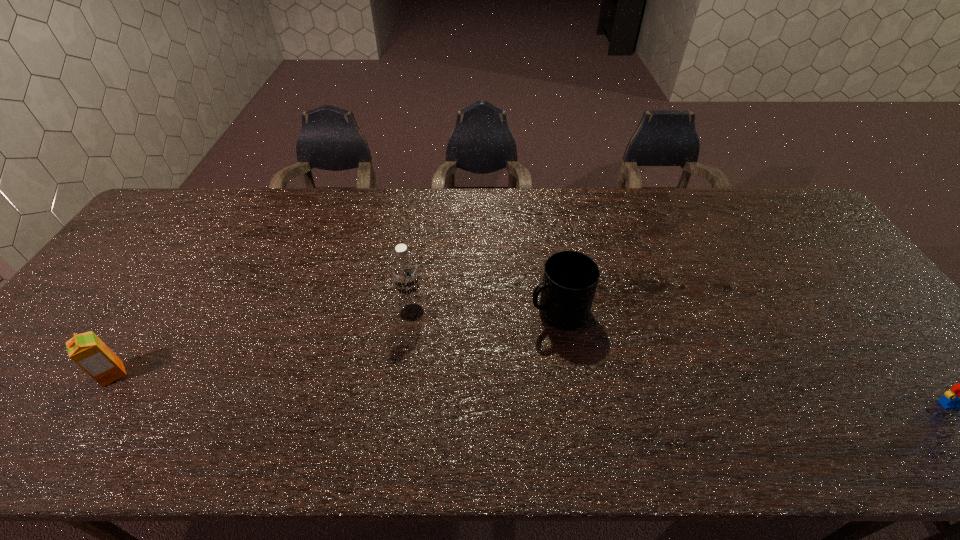
In order to click on free space on the desktop that is between the third farthest object and the nearest object and is positioned on the side of the mug with the handle in this screenshot , I will do click(404, 384).

Identify the location of vacant space on the desktop that is between the third farthest object and the nearest object and is positioned on the front label of the tallest object. (404, 384).